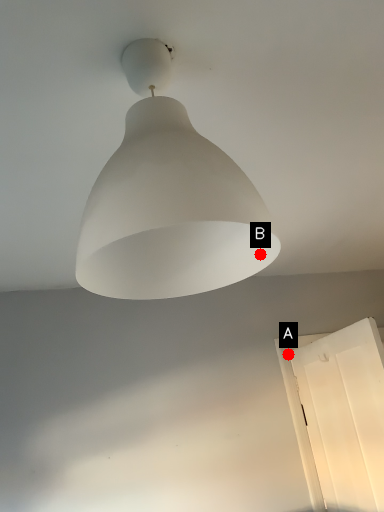
Question: Two points are circled on the image, labeled by A and B beside each circle. Which of the following is the farthest from the observer?

Choices:
 (A) A is further
 (B) B is further

Answer: (A)